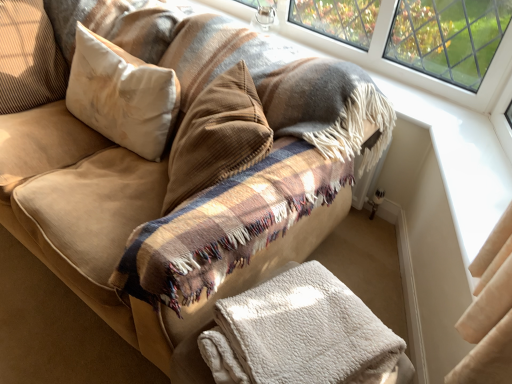
The width and height of the screenshot is (512, 384). What are the coordinates of `white fluffy blanket at lower center` in the screenshot? It's located at (298, 333).

From the image's perspective, which one is positioned higher, white fluffy blanket at lower center or white soft pillow at upper left, acting as the 2th pillow starting from the left?

white soft pillow at upper left, acting as the 2th pillow starting from the left.

Considering the relative positions of white fluffy blanket at lower center and white soft pillow at upper left, the first pillow positioned from the right, in the image provided, is white fluffy blanket at lower center to the left of white soft pillow at upper left, the first pillow positioned from the right, from the viewer's perspective?

Incorrect, white fluffy blanket at lower center is not on the left side of white soft pillow at upper left, the first pillow positioned from the right.

Would you consider white fluffy blanket at lower center to be distant from white soft pillow at upper left, the first pillow positioned from the right?

No, white fluffy blanket at lower center is not far away from white soft pillow at upper left, the first pillow positioned from the right.

Between point (320, 297) and point (134, 117), which one is positioned behind?

Point (134, 117)

Where is `the 2nd pillow to the left when counting from the white fluffy blanket at lower center`? the 2nd pillow to the left when counting from the white fluffy blanket at lower center is located at coordinates (29, 58).

Considering the sizes of white fluffy blanket at lower center and suede-like beige pillow at upper left, marked as the second pillow in a right-to-left arrangement, in the image, is white fluffy blanket at lower center wider or thinner than suede-like beige pillow at upper left, marked as the second pillow in a right-to-left arrangement,?

Considering their sizes, white fluffy blanket at lower center looks broader than suede-like beige pillow at upper left, marked as the second pillow in a right-to-left arrangement.

From a real-world perspective, relative to suede-like beige pillow at upper left, which ranks as the 1th pillow in left-to-right order, is white fluffy blanket at lower center vertically above or below?

white fluffy blanket at lower center is below suede-like beige pillow at upper left, which ranks as the 1th pillow in left-to-right order.

How many degrees apart are the facing directions of white fluffy blanket at lower center and suede-like beige pillow at upper left, marked as the second pillow in a right-to-left arrangement?

The facing directions of white fluffy blanket at lower center and suede-like beige pillow at upper left, marked as the second pillow in a right-to-left arrangement, are 87.8 degrees apart.

Can you tell me how much white soft pillow at upper left, the first pillow positioned from the right, and suede-like beige pillow at upper left, which ranks as the 1th pillow in left-to-right order, differ in facing direction?

They differ by 82.1 degrees in their facing directions.

Considering the sizes of objects white soft pillow at upper left, acting as the 2th pillow starting from the left, and suede-like beige pillow at upper left, which ranks as the 1th pillow in left-to-right order, in the image provided, who is wider, white soft pillow at upper left, acting as the 2th pillow starting from the left, or suede-like beige pillow at upper left, which ranks as the 1th pillow in left-to-right order,?

suede-like beige pillow at upper left, which ranks as the 1th pillow in left-to-right order.

Is white soft pillow at upper left, the first pillow positioned from the right, beside suede-like beige pillow at upper left, marked as the second pillow in a right-to-left arrangement?

white soft pillow at upper left, the first pillow positioned from the right, is not next to suede-like beige pillow at upper left, marked as the second pillow in a right-to-left arrangement, and they're not touching.

I want to click on pillow lying behind the white soft pillow at upper left, acting as the 2th pillow starting from the left, so click(x=29, y=58).

How many degrees apart are the facing directions of suede-like beige pillow at upper left, marked as the second pillow in a right-to-left arrangement, and white fluffy blanket at lower center?

87.8 degrees separate the facing orientations of suede-like beige pillow at upper left, marked as the second pillow in a right-to-left arrangement, and white fluffy blanket at lower center.

Who is shorter, suede-like beige pillow at upper left, which ranks as the 1th pillow in left-to-right order, or white fluffy blanket at lower center?

Standing shorter between the two is white fluffy blanket at lower center.

Is white fluffy blanket at lower center surrounded by suede-like beige pillow at upper left, which ranks as the 1th pillow in left-to-right order?

No, white fluffy blanket at lower center is not a part of suede-like beige pillow at upper left, which ranks as the 1th pillow in left-to-right order.

Is white soft pillow at upper left, acting as the 2th pillow starting from the left, with white fluffy blanket at lower center?

No, white soft pillow at upper left, acting as the 2th pillow starting from the left, is not beside white fluffy blanket at lower center.

Locate an element on the screen. The width and height of the screenshot is (512, 384). the 1st pillow behind the white fluffy blanket at lower center, counting from the anchor's position is located at coordinates (122, 95).

Is white soft pillow at upper left, the first pillow positioned from the right, facing away from white fluffy blanket at lower center?

No, white fluffy blanket at lower center is not at the back of white soft pillow at upper left, the first pillow positioned from the right.

Between suede-like beige pillow at upper left, marked as the second pillow in a right-to-left arrangement, and white soft pillow at upper left, the first pillow positioned from the right, which one appears on the right side from the viewer's perspective?

Positioned to the right is white soft pillow at upper left, the first pillow positioned from the right.

Considering the sizes of objects suede-like beige pillow at upper left, marked as the second pillow in a right-to-left arrangement, and white soft pillow at upper left, acting as the 2th pillow starting from the left, in the image provided, who is thinner, suede-like beige pillow at upper left, marked as the second pillow in a right-to-left arrangement, or white soft pillow at upper left, acting as the 2th pillow starting from the left,?

white soft pillow at upper left, acting as the 2th pillow starting from the left.

Where is `pillow that is under the suede-like beige pillow at upper left, marked as the second pillow in a right-to-left arrangement (from a real-world perspective)`? This screenshot has height=384, width=512. pillow that is under the suede-like beige pillow at upper left, marked as the second pillow in a right-to-left arrangement (from a real-world perspective) is located at coordinates (122, 95).

Where is `material below the white soft pillow at upper left, acting as the 2th pillow starting from the left (from the image's perspective)`? The image size is (512, 384). material below the white soft pillow at upper left, acting as the 2th pillow starting from the left (from the image's perspective) is located at coordinates (298, 333).

At what (x,y) coordinates should I click in order to perform the action: click on the 2nd pillow above the white fluffy blanket at lower center (from the image's perspective). Please return your answer as a coordinate pair (x, y). Looking at the image, I should click on (29, 58).

Which object lies further to the anchor point white fluffy blanket at lower center, suede-like beige pillow at upper left, which ranks as the 1th pillow in left-to-right order, or white soft pillow at upper left, the first pillow positioned from the right?

The object further to white fluffy blanket at lower center is suede-like beige pillow at upper left, which ranks as the 1th pillow in left-to-right order.

Which object lies nearer to the anchor point white fluffy blanket at lower center, white soft pillow at upper left, the first pillow positioned from the right, or suede-like beige pillow at upper left, marked as the second pillow in a right-to-left arrangement?

white soft pillow at upper left, the first pillow positioned from the right, is closer to white fluffy blanket at lower center.

Considering their positions, is white fluffy blanket at lower center positioned closer to suede-like beige pillow at upper left, which ranks as the 1th pillow in left-to-right order, than white soft pillow at upper left, the first pillow positioned from the right?

white soft pillow at upper left, the first pillow positioned from the right, is positioned closer to the anchor suede-like beige pillow at upper left, which ranks as the 1th pillow in left-to-right order.

When comparing their distances from suede-like beige pillow at upper left, which ranks as the 1th pillow in left-to-right order, does white soft pillow at upper left, acting as the 2th pillow starting from the left, or white fluffy blanket at lower center seem closer?

white soft pillow at upper left, acting as the 2th pillow starting from the left, is positioned closer to the anchor suede-like beige pillow at upper left, which ranks as the 1th pillow in left-to-right order.

Looking at the image, which one is located closer to white soft pillow at upper left, acting as the 2th pillow starting from the left, suede-like beige pillow at upper left, which ranks as the 1th pillow in left-to-right order, or white fluffy blanket at lower center?

Based on the image, suede-like beige pillow at upper left, which ranks as the 1th pillow in left-to-right order, appears to be nearer to white soft pillow at upper left, acting as the 2th pillow starting from the left.

When comparing their distances from white soft pillow at upper left, acting as the 2th pillow starting from the left, does white fluffy blanket at lower center or suede-like beige pillow at upper left, which ranks as the 1th pillow in left-to-right order, seem closer?

The object closer to white soft pillow at upper left, acting as the 2th pillow starting from the left, is suede-like beige pillow at upper left, which ranks as the 1th pillow in left-to-right order.

The height and width of the screenshot is (384, 512). I want to click on pillow between suede-like beige pillow at upper left, which ranks as the 1th pillow in left-to-right order, and white fluffy blanket at lower center, so click(122, 95).